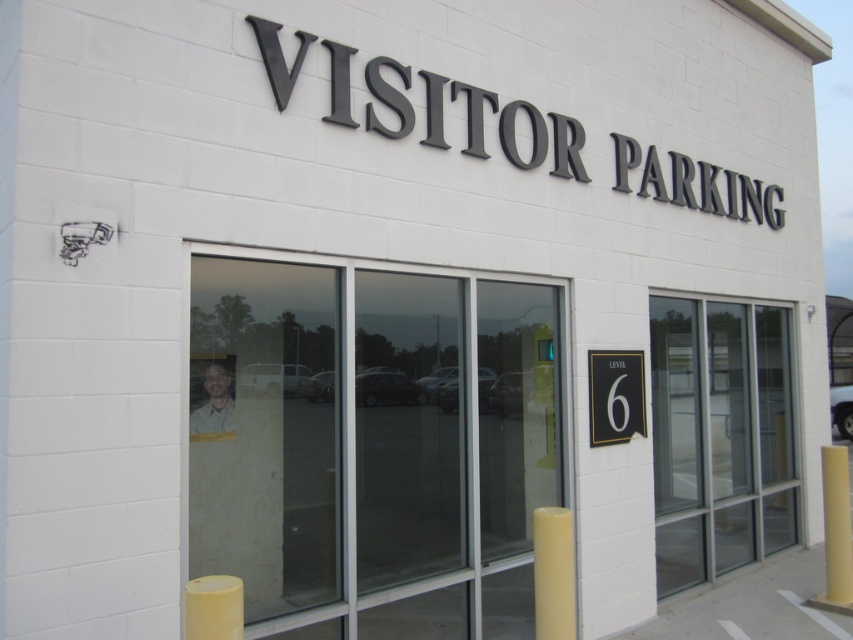
Question: Which object appears farthest from the camera in this image?

Choices:
 (A) transparent glass door at right
 (B) transparent glass door at center

Answer: (A)

Question: Based on their relative distances, which object is farther from the transparent glass door at right?

Choices:
 (A) yellow matte/soft pillar at lower right
 (B) yellow matte pole at right
 (C) black plastic sign at center
 (D) light brown shirt at lower left

Answer: (D)

Question: Estimate the real-world distances between objects in this image. Which object is closer to the transparent glass door at right?

Choices:
 (A) black plastic sign at center
 (B) transparent glass door at center
 (C) light brown shirt at lower left
 (D) yellow matte/soft pillar at lower right

Answer: (A)

Question: Can you confirm if black plastic sign at center is wider than yellow matte pillar at lower left?

Choices:
 (A) yes
 (B) no

Answer: (A)

Question: Observing the image, what is the correct spatial positioning of black plastic sign at center in reference to yellow matte pole at right?

Choices:
 (A) left
 (B) right

Answer: (A)

Question: Does transparent glass door at center have a greater width compared to yellow matte pillar at lower left?

Choices:
 (A) yes
 (B) no

Answer: (B)